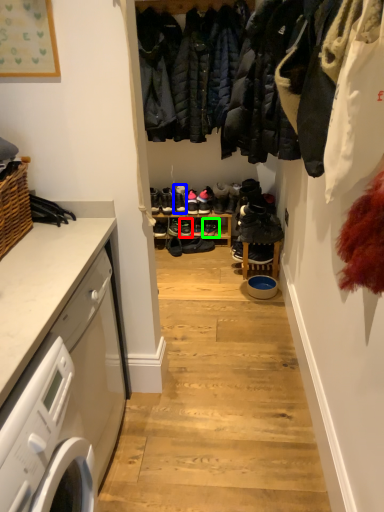
Question: Which object is positioned farthest from footwear (highlighted by a red box)? Select from footwear (highlighted by a blue box) and footwear (highlighted by a green box).

Choices:
 (A) footwear
 (B) footwear

Answer: (A)